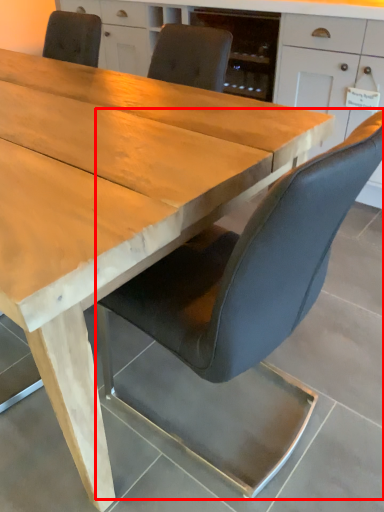
Question: From the image, what is the correct spatial relationship of chair (annotated by the red box) in relation to cabinetry?

Choices:
 (A) right
 (B) left

Answer: (B)